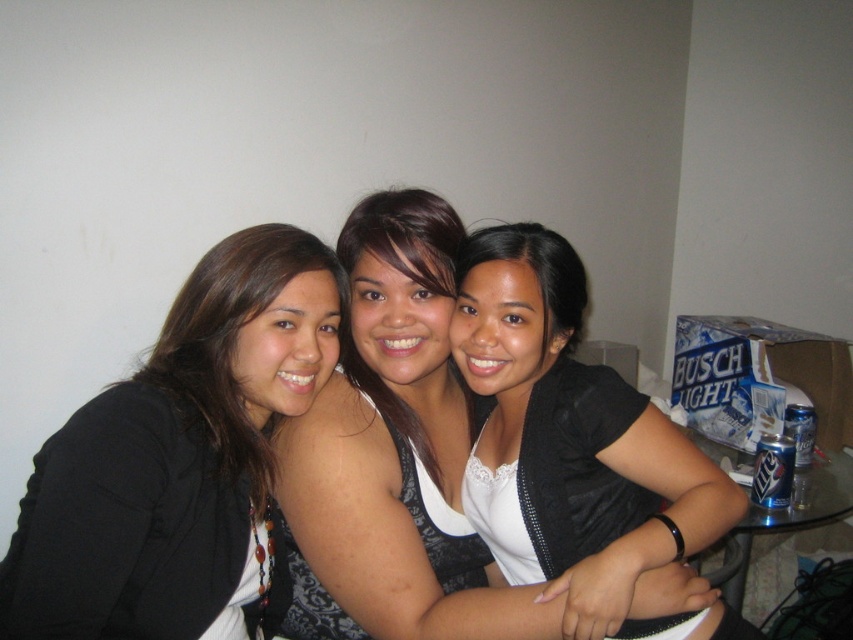
You are designing a layout for a magazine cover and need to place a text box at the exact coordinates of the point provided. The coordinates are given in normalized units between 0 and 1. The text box must not overlap with any clothing items in the image. Based on the scene description, can you confirm if placing the text box at point (173, 458) will overlap with the matte black jacket at center?

The point (173, 458) indicates the location of the matte black jacket at center. Placing the text box at this coordinate would directly overlap with the matte black jacket at center, so it is not advisable.

You are trying to identify the clothing items in the image. Which of the two jackets, the matte black jacket at center or the black matte jacket at center, is located lower in the image?

The matte black jacket at center is positioned under the black matte jacket at center, so it is located lower in the image.